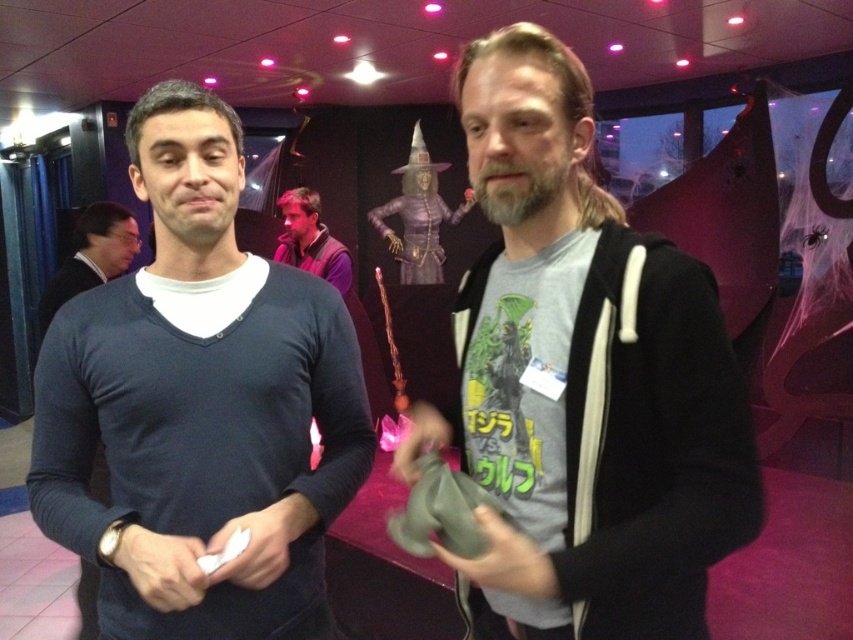
You are organizing a costume party and need to arrange two outfits on a display rack. The matte black sweater at left and the purple velvet shirt at center must be placed vertically. Which outfit should be placed lower on the rack to ensure proper visibility of both?

The matte black sweater at left has a lesser height compared to the purple velvet shirt at center, so it should be placed lower on the rack to ensure the taller purple velvet shirt at center is visible above it.

You are a photographer standing 1.68 meters tall and holding a camera. You want to take a photo of the matte black sweater at left. If the camera is at your eye level, will the sweater be in focus if you focus on an object 2 meters away?

The matte black sweater at left is 2.32 meters away from the camera. Since the camera is focused on an object 2 meters away, the sweater is beyond the focused distance and may not be in sharp focus. Adjust the focus to 2.32 meters for better clarity.